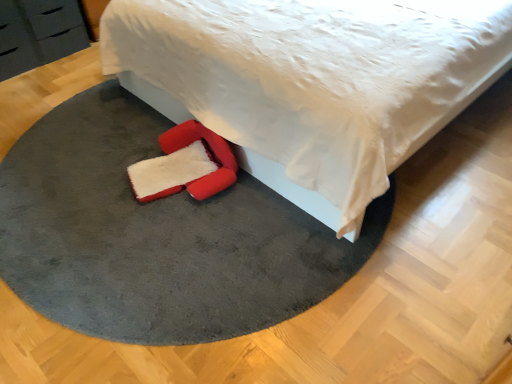
Locate an element on the screen. The width and height of the screenshot is (512, 384). free region on the left part of velvet-like red footrest at lower center is located at coordinates (84, 182).